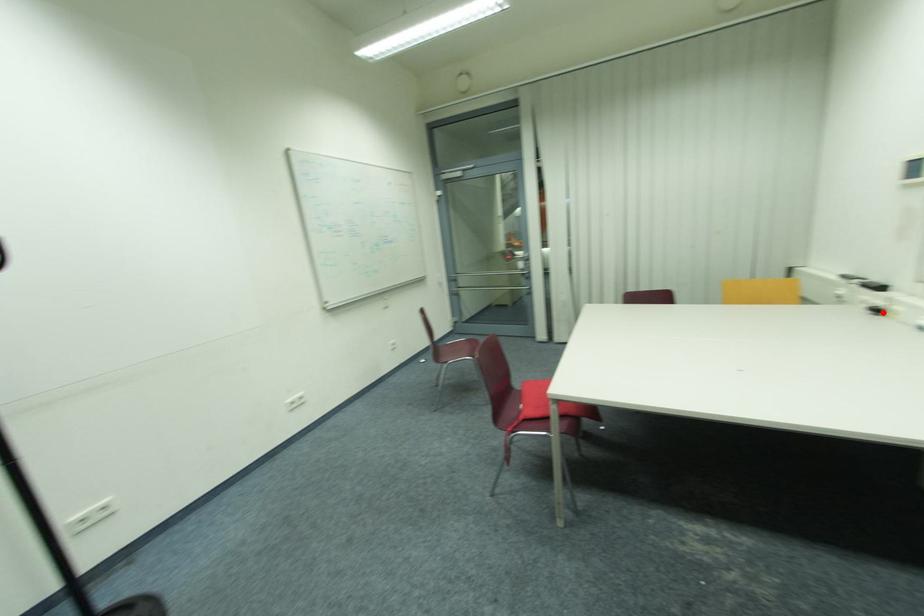
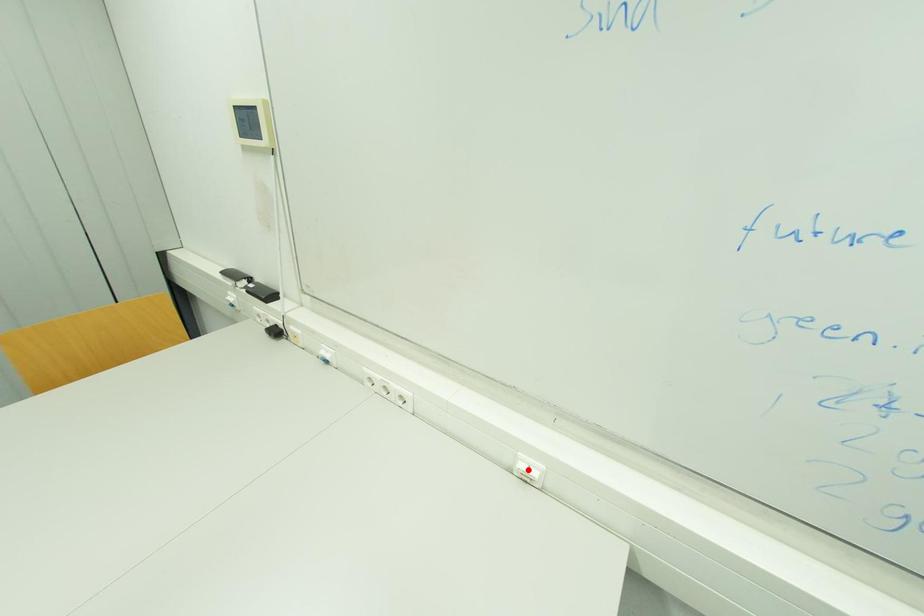
I am providing you with two images of the same scene from different viewpoints. A red point is marked on the first image and another point is marked on the second image. Is the red point in image1 aligned with the point shown in image2?

No